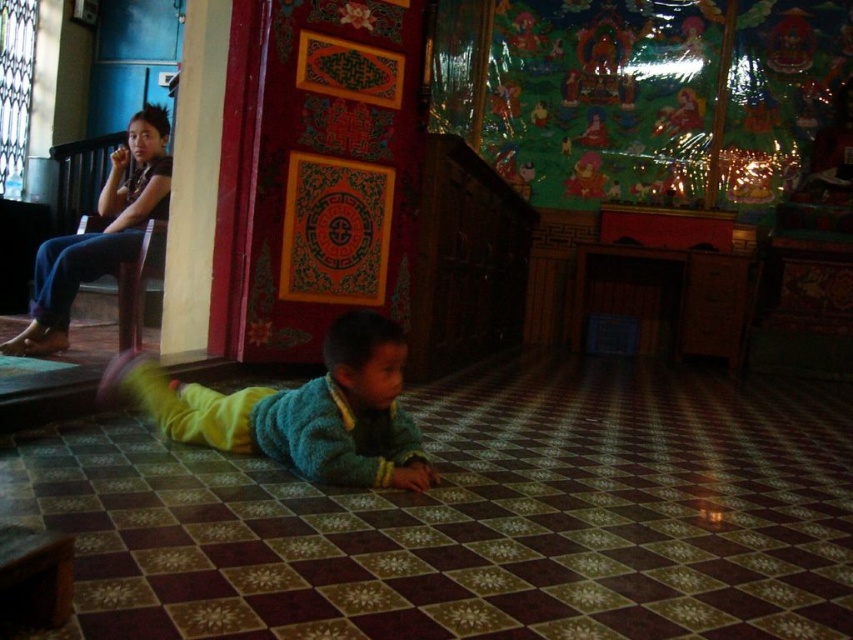
Question: In this image, where is knitted green sweater at center located relative to jeans at left?

Choices:
 (A) above
 (B) below

Answer: (B)

Question: Which object is closer to the camera taking this photo?

Choices:
 (A) knitted green sweater at center
 (B) jeans at left

Answer: (A)

Question: Does knitted green sweater at center have a lesser width compared to jeans at left?

Choices:
 (A) yes
 (B) no

Answer: (B)

Question: Can you confirm if knitted green sweater at center is positioned to the left of jeans at left?

Choices:
 (A) no
 (B) yes

Answer: (A)

Question: Which point is closer to the camera?

Choices:
 (A) (376, 428)
 (B) (167, 129)

Answer: (A)